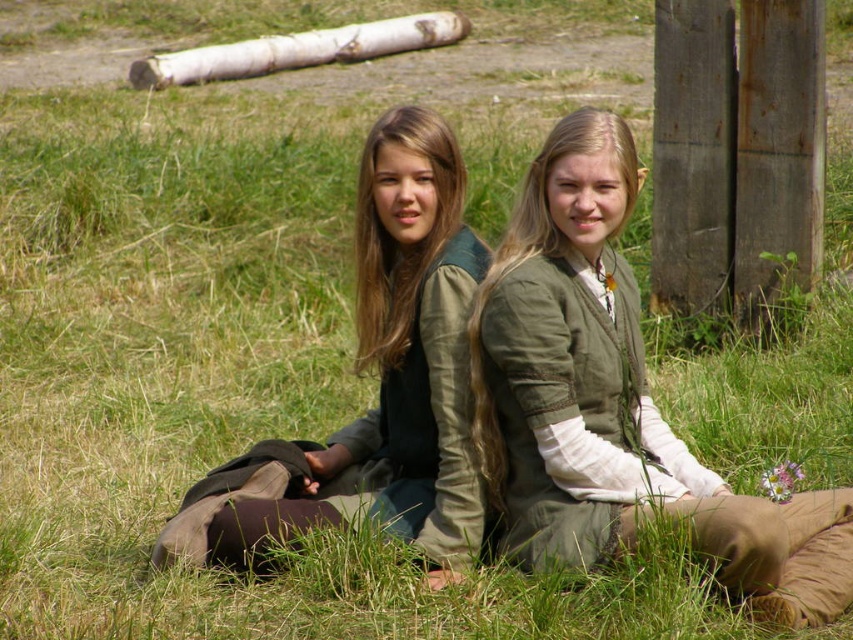
Which of these two, green linen tunic at center or matte green vest at center, stands taller?

With more height is green linen tunic at center.

Where is `green linen tunic at center`? green linen tunic at center is located at coordinates (614, 403).

How much distance is there between green linen tunic at center and white bark log at upper center?

They are 16.30 meters apart.

Does green linen tunic at center appear over white bark log at upper center?

Actually, green linen tunic at center is below white bark log at upper center.

What are the coordinates of `green linen tunic at center` in the screenshot? It's located at (614, 403).

Find the location of a particular element. The width and height of the screenshot is (853, 640). green linen tunic at center is located at coordinates (614, 403).

Between matte green vest at center and white bark log at upper center, which one is positioned higher?

Positioned higher is white bark log at upper center.

Can you confirm if matte green vest at center is taller than white bark log at upper center?

No.

The width and height of the screenshot is (853, 640). What do you see at coordinates (387, 369) in the screenshot?
I see `matte green vest at center` at bounding box center [387, 369].

The image size is (853, 640). What are the coordinates of `matte green vest at center` in the screenshot? It's located at (387, 369).